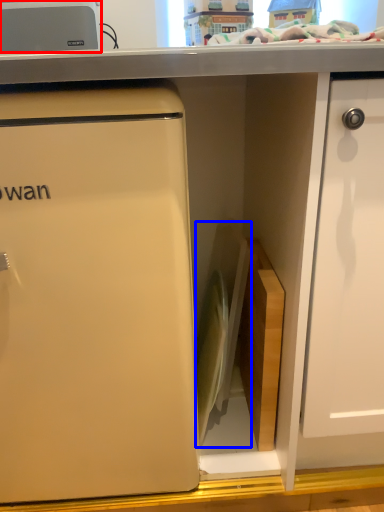
Question: Which object appears closest to the camera in this image, appliance (highlighted by a red box) or appliance (highlighted by a blue box)?

Choices:
 (A) appliance
 (B) appliance

Answer: (B)